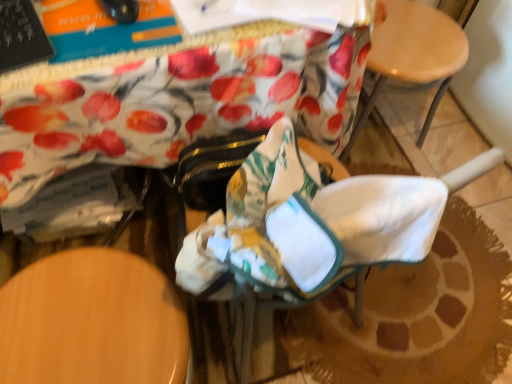
Question: Considering the positions of white fabric rocking chair at center and wooden at upper right in the image, is white fabric rocking chair at center wider or thinner than wooden at upper right?

Choices:
 (A) thin
 (B) wide

Answer: (B)

Question: Choose the correct answer: Is white fabric rocking chair at center inside wooden at upper right or outside it?

Choices:
 (A) inside
 (B) outside

Answer: (B)

Question: From the image's perspective, relative to wooden at upper right, is white fabric rocking chair at center above or below?

Choices:
 (A) above
 (B) below

Answer: (B)

Question: Is point (370, 104) positioned closer to the camera than point (439, 276)?

Choices:
 (A) farther
 (B) closer

Answer: (A)

Question: Would you say wooden at upper right is to the left or to the right of white fabric rocking chair at center in the picture?

Choices:
 (A) left
 (B) right

Answer: (B)

Question: From a real-world perspective, is wooden at upper right positioned above or below white fabric rocking chair at center?

Choices:
 (A) above
 (B) below

Answer: (B)

Question: Looking at their shapes, would you say wooden at upper right is wider or thinner than white fabric rocking chair at center?

Choices:
 (A) wide
 (B) thin

Answer: (B)